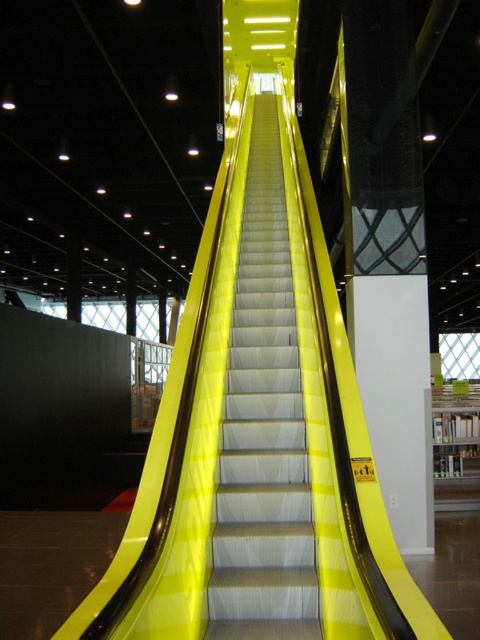
You are standing at the entrance of a shopping mall and see the yellow glossy escalator at center and the white glossy pillar at center. Which object appears shorter in height?

The yellow glossy escalator at center is not as tall as the white glossy pillar at center, so the yellow glossy escalator at center appears shorter in height.

You are standing in front of the escalator and see two points marked on the image. Which point, point [289,636] or point [346,93], is closer to you?

Point [289,636] is closer to the viewer than point [346,93].

You are standing in front of the yellow glossy escalator at center. If you want to take a photo of it from where you are standing, will you need to zoom in or out to capture the entire escalator in the frame?

Since the yellow glossy escalator at center is 2.79 meters away from you, you would need to zoom out to ensure the entire escalator fits within the camera frame.